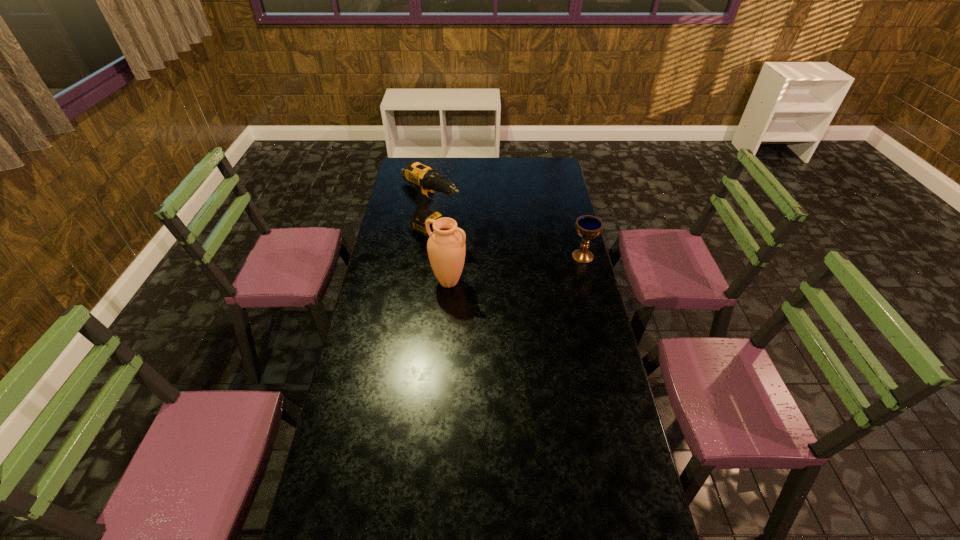
Where is `the nearest object`? the nearest object is located at coordinates (446, 247).

The image size is (960, 540). I want to click on the third farthest object, so click(x=588, y=227).

Where is `chalice`? chalice is located at coordinates (588, 227).

Locate an element on the screen. the farthest object is located at coordinates tap(401, 171).

Locate an element on the screen. Image resolution: width=960 pixels, height=540 pixels. the shortest object is located at coordinates (401, 171).

You are a GUI agent. You are given a task and a screenshot of the screen. Output one action in this format:
    pyautogui.click(x=<x>, y=<y>)
    Task: Click on the drill
    The height and width of the screenshot is (540, 960).
    Given the screenshot: What is the action you would take?
    pyautogui.click(x=427, y=181)

Identify the location of free region located 0.260m on the back of the nearest object. (452, 232).

The width and height of the screenshot is (960, 540). Identify the location of vacant space situated 0.370m on the back of the rightmost object. (569, 201).

Identify the location of blank space located 0.080m on the head of the shortest object. The width and height of the screenshot is (960, 540). (435, 204).

Locate an element on the screen. This screenshot has height=540, width=960. vacant space located 0.240m on the head of the shortest object is located at coordinates (453, 219).